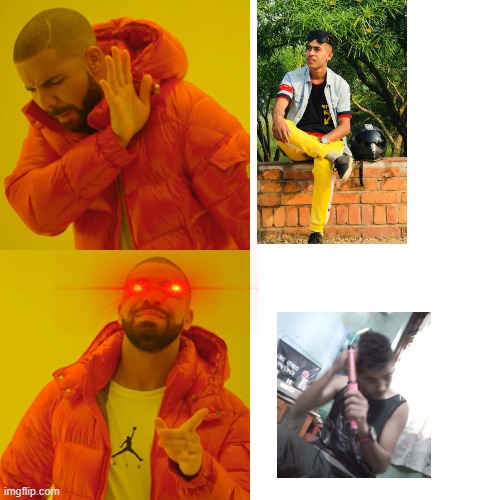
Identify the location of beams. The image size is (500, 500). (111, 286), (210, 288).